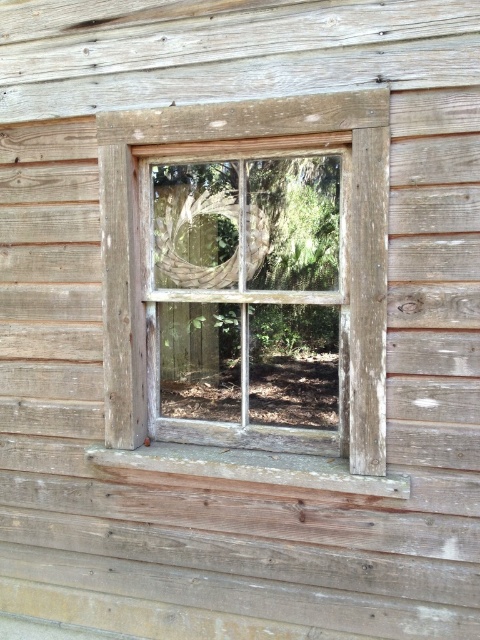
Question: Is weathered wood window at center in front of weathered wood at bottom?

Choices:
 (A) no
 (B) yes

Answer: (B)

Question: Which point is farther from the camera taking this photo?

Choices:
 (A) [216, 346]
 (B) [250, 452]

Answer: (A)

Question: Is weathered wood window at center behind weathered wood at bottom?

Choices:
 (A) no
 (B) yes

Answer: (A)

Question: Among these points, which one is nearest to the camera?

Choices:
 (A) (130, 316)
 (B) (144, 449)

Answer: (A)

Question: Which object appears closest to the camera in this image?

Choices:
 (A) weathered wood at bottom
 (B) weathered wood window at center

Answer: (B)

Question: Can you confirm if weathered wood window at center is positioned to the right of weathered wood at bottom?

Choices:
 (A) no
 (B) yes

Answer: (A)